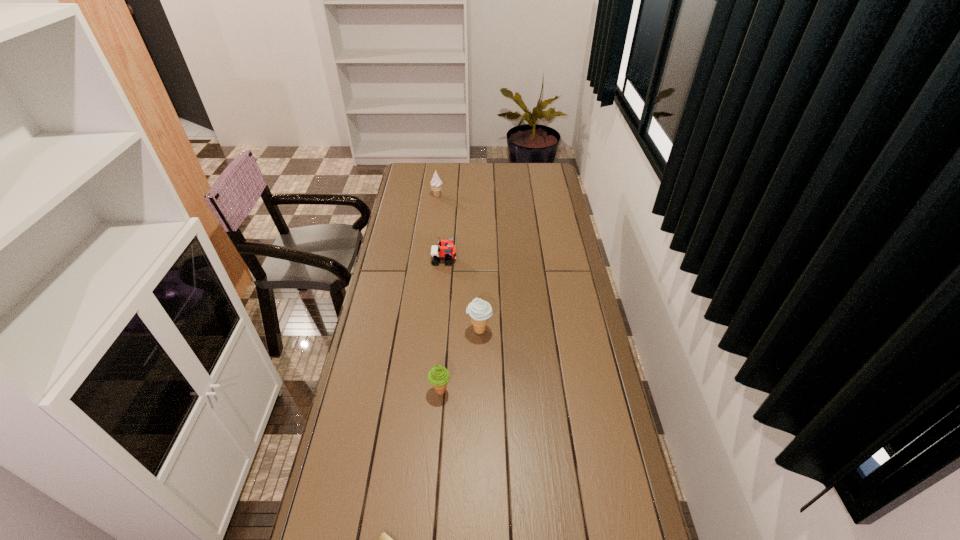
The width and height of the screenshot is (960, 540). Identify the location of free space that satisfies the following two spatial constraints: 1. on the back side of the nearest icecream; 2. on the front-facing side of the Lego. (450, 260).

I want to click on vacant space that satisfies the following two spatial constraints: 1. on the front-facing side of the second farthest object; 2. on the back side of the second nearest object, so click(x=433, y=390).

The image size is (960, 540). Find the location of `free space that satisfies the following two spatial constraints: 1. on the front-facing side of the Lego; 2. on the left side of the second nearest object`. free space that satisfies the following two spatial constraints: 1. on the front-facing side of the Lego; 2. on the left side of the second nearest object is located at coordinates (433, 390).

This screenshot has height=540, width=960. In order to click on free location that satisfies the following two spatial constraints: 1. on the front-facing side of the second farthest object; 2. on the right side of the second farthest icecream in this screenshot , I will do `click(438, 330)`.

This screenshot has width=960, height=540. Find the location of `vacant space that satisfies the following two spatial constraints: 1. on the front-facing side of the second farthest object; 2. on the left side of the rightmost object`. vacant space that satisfies the following two spatial constraints: 1. on the front-facing side of the second farthest object; 2. on the left side of the rightmost object is located at coordinates (438, 330).

Image resolution: width=960 pixels, height=540 pixels. In order to click on free spot that satisfies the following two spatial constraints: 1. on the front-facing side of the farthest object; 2. on the left side of the second nearest object in this screenshot , I will do `click(412, 390)`.